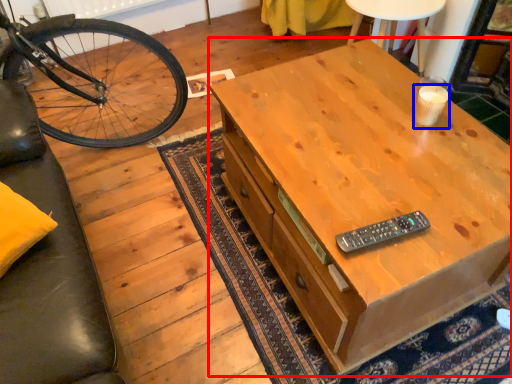
Question: Which object appears farthest to the camera in this image, desk (highlighted by a red box) or coffee cup (highlighted by a blue box)?

Choices:
 (A) desk
 (B) coffee cup

Answer: (B)